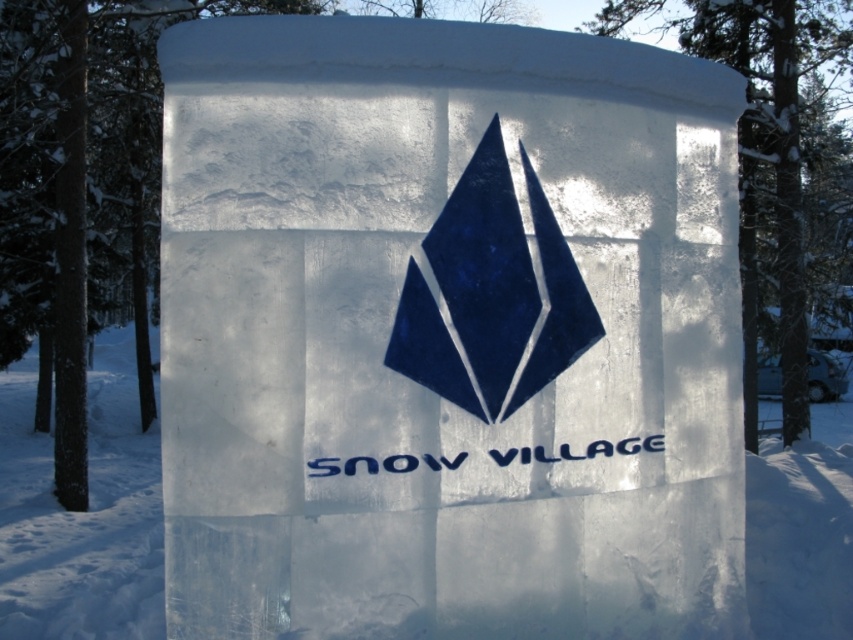
Question: Which point is farther to the camera?

Choices:
 (A) blue glossy diamond at center
 (B) transparent ice at center

Answer: (B)

Question: Is transparent ice at center closer to camera compared to blue glossy diamond at center?

Choices:
 (A) no
 (B) yes

Answer: (A)

Question: Is transparent ice at center to the right of blue glossy diamond at center from the viewer's perspective?

Choices:
 (A) yes
 (B) no

Answer: (A)

Question: Which point is farther to the camera?

Choices:
 (A) blue glossy diamond at center
 (B) transparent ice at center

Answer: (B)

Question: Can you confirm if transparent ice at center is positioned to the right of blue glossy diamond at center?

Choices:
 (A) no
 (B) yes

Answer: (B)